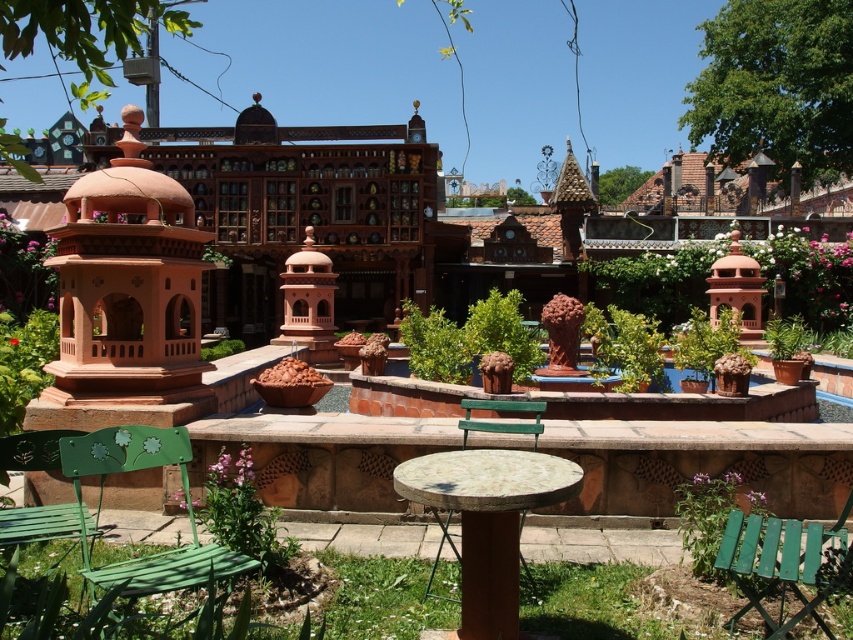
Can you confirm if green metal bench at lower left is smaller than green painted wood bench at lower left?

Incorrect, green metal bench at lower left is not smaller in size than green painted wood bench at lower left.

Which is behind, point (108, 433) or point (51, 467)?

The point (51, 467) is behind.

Between point (160, 440) and point (35, 513), which one is positioned behind?

The point (35, 513) is behind.

Where is `green metal bench at lower left`? Image resolution: width=853 pixels, height=640 pixels. green metal bench at lower left is located at coordinates (184, 499).

Which of these two, terracotta clay gazebo at left or green painted wood bench at lower left, stands shorter?

With less height is green painted wood bench at lower left.

Where is `terracotta clay gazebo at left`? The width and height of the screenshot is (853, 640). terracotta clay gazebo at left is located at coordinates (128, 285).

Between point (148, 288) and point (64, 536), which one is positioned in front?

Positioned in front is point (64, 536).

Locate an element on the screen. The width and height of the screenshot is (853, 640). terracotta clay gazebo at left is located at coordinates (128, 285).

Can you confirm if terracotta clay gazebo at left is taller than green metal bench at lower left?

Yes.

Is point (109, 392) positioned behind point (171, 576)?

Yes.

What are the coordinates of `terracotta clay gazebo at left` in the screenshot? It's located at (128, 285).